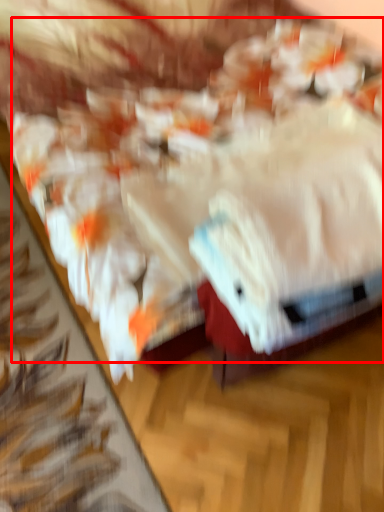
Question: From the image's perspective, where is food (annotated by the red box) located in relation to towel in the image?

Choices:
 (A) below
 (B) above

Answer: (B)